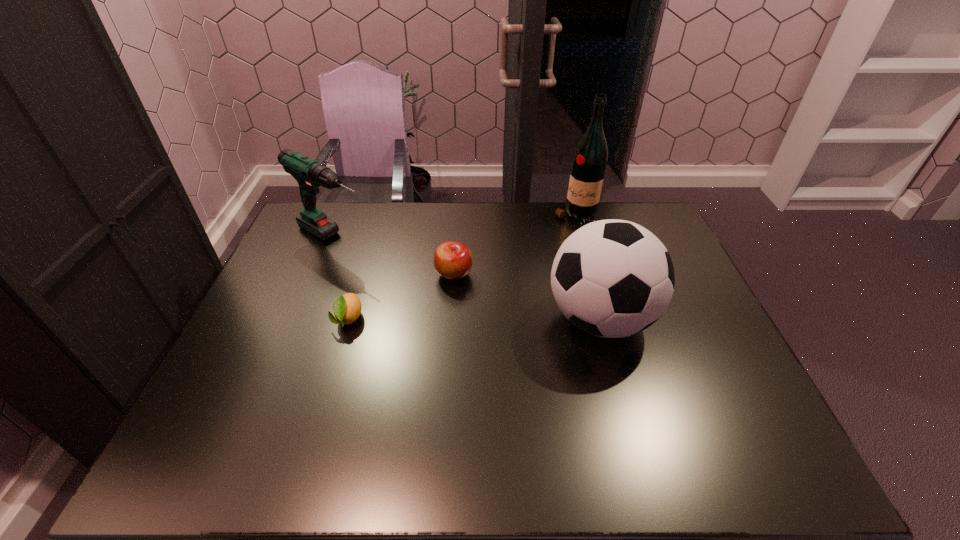
Find the location of a particular element. Image resolution: width=960 pixels, height=540 pixels. vacant point located between the wine bottle and the drill is located at coordinates (455, 228).

Where is `empty space that is in between the third object from right to left and the lemon`? The image size is (960, 540). empty space that is in between the third object from right to left and the lemon is located at coordinates (401, 296).

This screenshot has width=960, height=540. I want to click on vacant region between the wine bottle and the drill, so click(x=455, y=228).

The width and height of the screenshot is (960, 540). I want to click on empty space between the soccer ball and the shortest object, so tap(474, 319).

You are a GUI agent. You are given a task and a screenshot of the screen. Output one action in this format:
    pyautogui.click(x=<x>, y=<y>)
    Task: Click on the object that is the fourth closest one to the second shortest object
    
    Given the screenshot: What is the action you would take?
    pyautogui.click(x=589, y=162)

Identify which object is the fourth closest to the tallest object. Please provide its 2D coordinates. Your answer should be formatted as a tuple, i.e. [(x, y)], where the tuple contains the x and y coordinates of a point satisfying the conditions above.

[(347, 308)]

Where is `free spot that satisfies the following two spatial constraints: 1. on the front side of the drill; 2. on the right side of the soccer ball`? This screenshot has width=960, height=540. free spot that satisfies the following two spatial constraints: 1. on the front side of the drill; 2. on the right side of the soccer ball is located at coordinates (301, 319).

I want to click on vacant region that satisfies the following two spatial constraints: 1. on the back side of the drill; 2. on the left side of the tallest object, so click(343, 217).